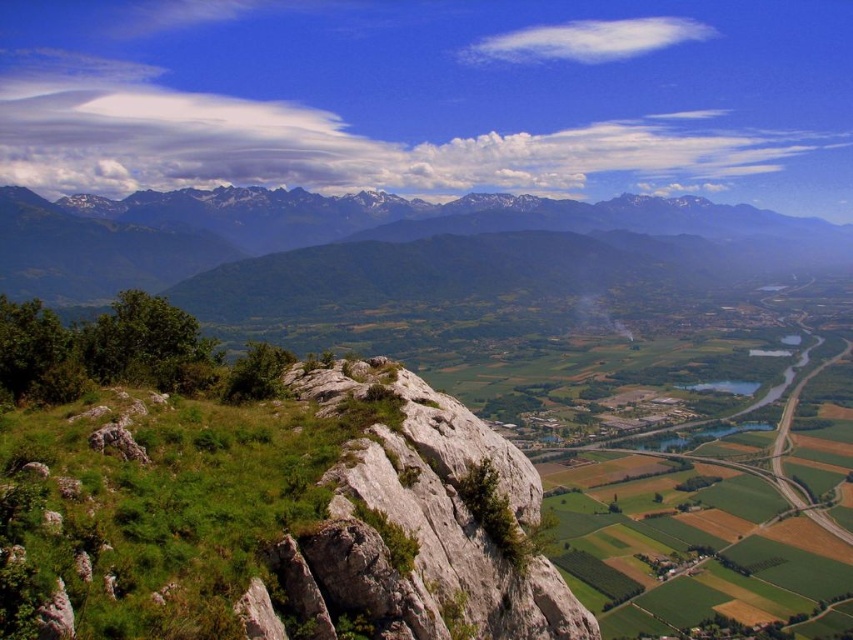
Which is more to the left, green grassy rock at center or gray rocky mountains at upper left?

From the viewer's perspective, gray rocky mountains at upper left appears more on the left side.

Which is below, green grassy rock at center or gray rocky mountains at upper left?

green grassy rock at center is lower down.

Is point (351, 515) positioned after point (387, 237)?

No, (351, 515) is in front of (387, 237).

Where is `green grassy rock at center`? green grassy rock at center is located at coordinates (260, 502).